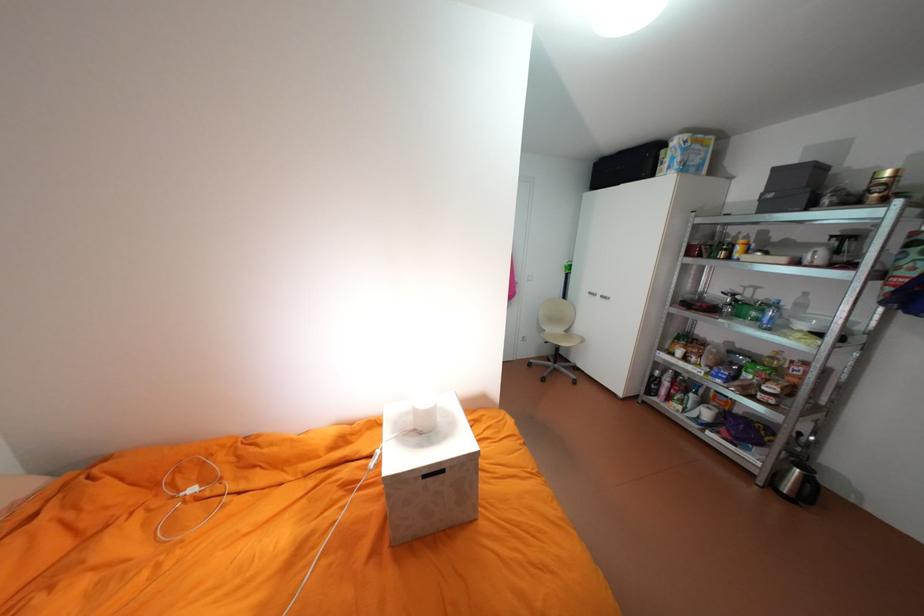
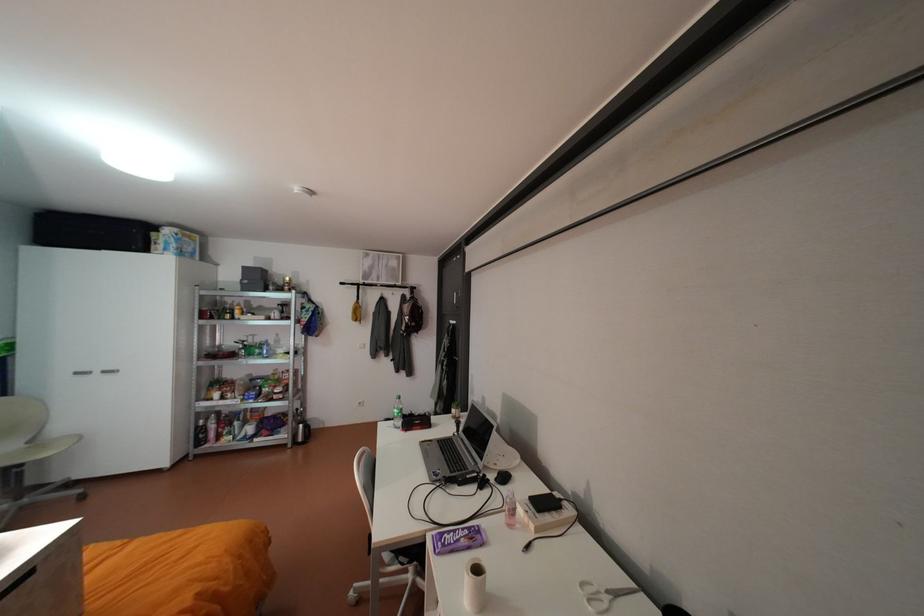
Question: The first image is from the beginning of the video and the second image is from the end. How did the camera likely rotate when shooting the video?

Choices:
 (A) Left
 (B) Right
 (C) Up
 (D) Down

Answer: (B)